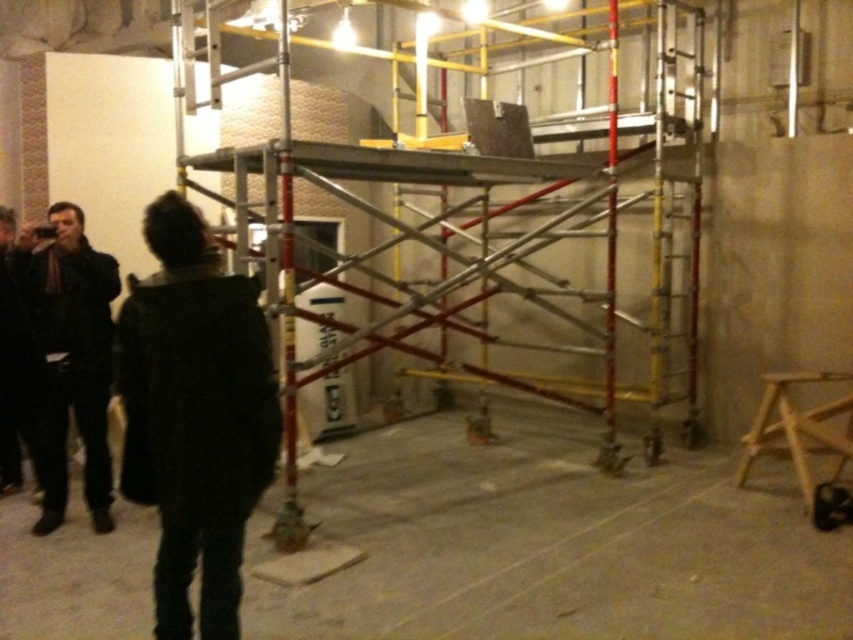
You are a worker standing at the entrance of the room. You need to place a heavy equipment on the concrete floor at center. Based on the coordinates provided, where exactly should you position the equipment?

The concrete floor at center is located at point (x=550, y=545), so you should position the equipment there.

In the scene shown: You are a construction worker entering the room and see both the dark green jacket at left and the dark brown leather jacket at left. Which jacket is closer to you?

The dark green jacket at left is closer to you because it is in front of the dark brown leather jacket at left.

You are a worker standing at the center of the room and need to reach both the point at coordinates point (379, 432) and point (106, 474). Which point should you move towards first if you want to reach the one closer to you first?

You should move towards point (106, 474) first because it is closer to you than point (379, 432), which is further away.